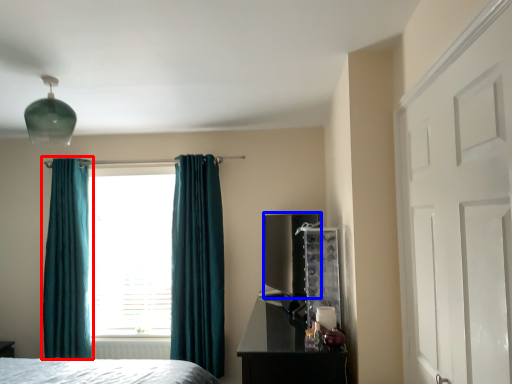
Question: Which object is closer to the camera taking this photo, curtain (highlighted by a red box) or appliance (highlighted by a blue box)?

Choices:
 (A) curtain
 (B) appliance

Answer: (B)